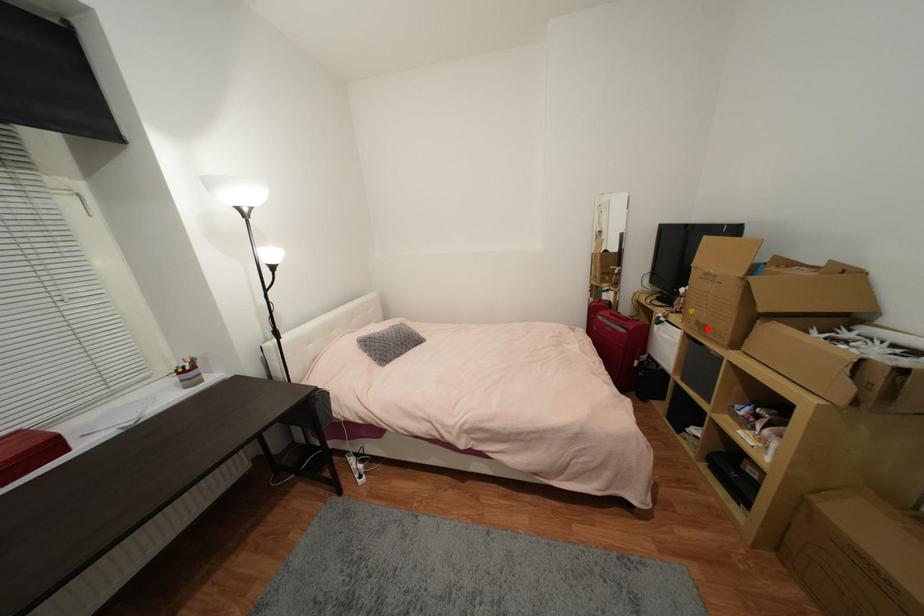
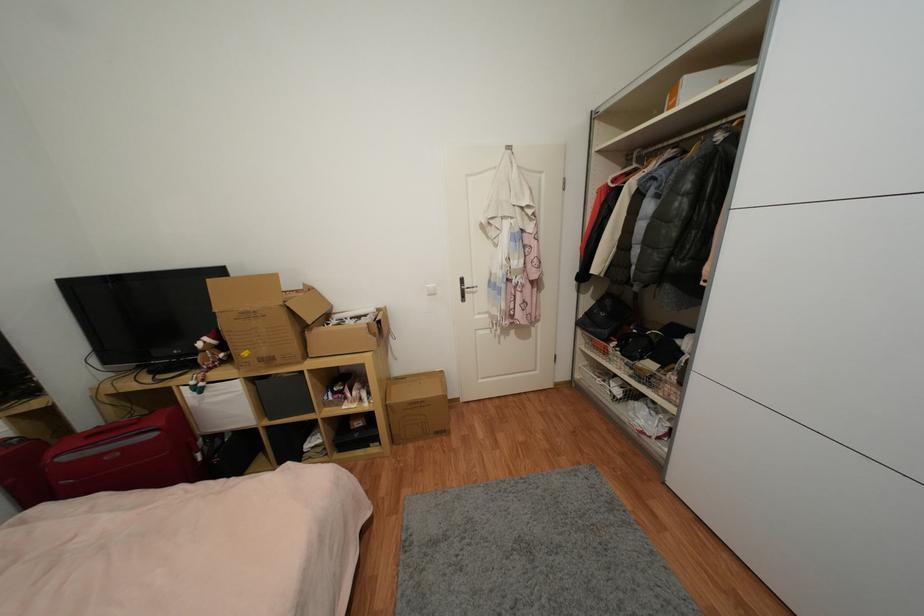
Where in the second image is the point corresponding to the highlighted location from the first image?

(274, 361)